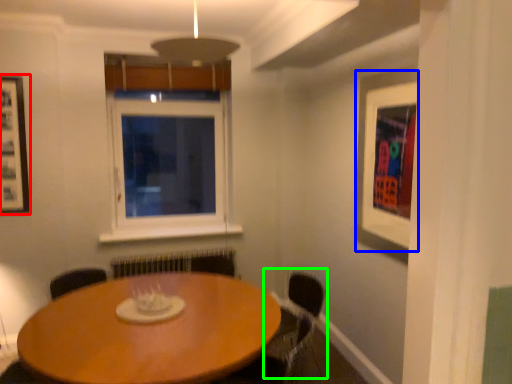
Question: Which object is the farthest from picture frame (highlighted by a red box)? Choose among these: picture frame (highlighted by a blue box) or armchair (highlighted by a green box).

Choices:
 (A) picture frame
 (B) armchair

Answer: (A)